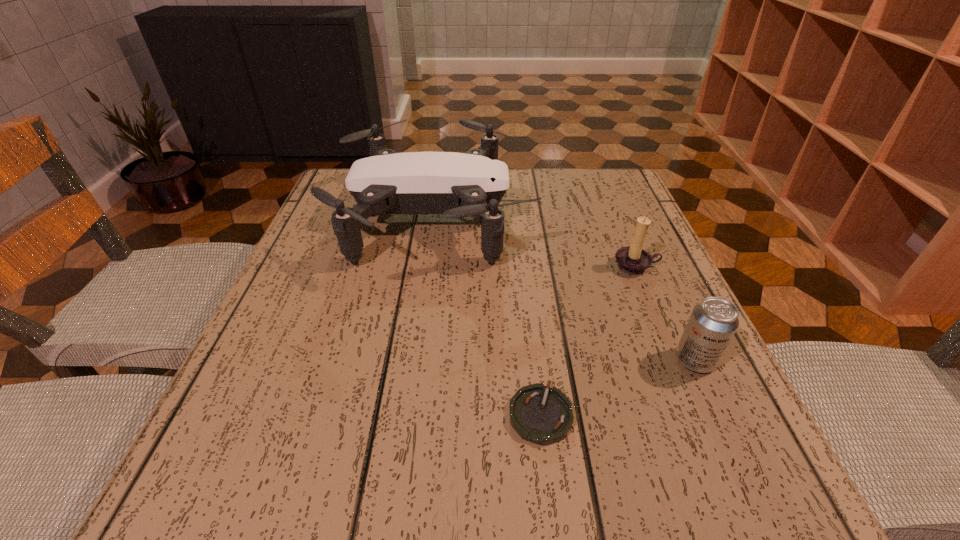
The image size is (960, 540). Find the location of `object that stands as the second closest to the nearest object`. object that stands as the second closest to the nearest object is located at coordinates (456, 185).

The width and height of the screenshot is (960, 540). In order to click on free location that satisfies the following two spatial constraints: 1. on the camera side of the drone; 2. on the back side of the third farthest object in this screenshot , I will do `click(415, 360)`.

Image resolution: width=960 pixels, height=540 pixels. Identify the location of free spot that satisfies the following two spatial constraints: 1. on the camera side of the tallest object; 2. on the back side of the nearest object. (407, 414).

I want to click on vacant area in the image that satisfies the following two spatial constraints: 1. on the camera side of the drone; 2. on the left side of the ashtray, so click(407, 414).

The height and width of the screenshot is (540, 960). Identify the location of vacant region that satisfies the following two spatial constraints: 1. on the camera side of the third farthest object; 2. on the left side of the drone. (415, 360).

Where is `free space that satisfies the following two spatial constraints: 1. on the back side of the second nearest object; 2. on the right side of the shortest object`? The image size is (960, 540). free space that satisfies the following two spatial constraints: 1. on the back side of the second nearest object; 2. on the right side of the shortest object is located at coordinates (534, 360).

Where is `free point that satisfies the following two spatial constraints: 1. on the camera side of the drone; 2. on the right side of the third farthest object`? The width and height of the screenshot is (960, 540). free point that satisfies the following two spatial constraints: 1. on the camera side of the drone; 2. on the right side of the third farthest object is located at coordinates (415, 360).

The width and height of the screenshot is (960, 540). Identify the location of vacant space that satisfies the following two spatial constraints: 1. on the camera side of the beer can; 2. on the left side of the tallest object. click(415, 360).

Identify the location of free space that satisfies the following two spatial constraints: 1. on the wick of the third farthest object; 2. on the right side of the candle holder. (676, 360).